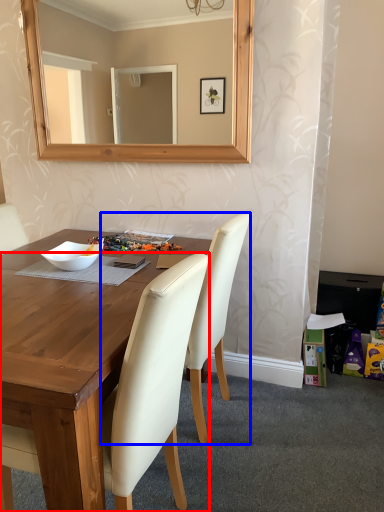
Question: Which point is closer to the camera, chair (highlighted by a red box) or chair (highlighted by a blue box)?

Choices:
 (A) chair
 (B) chair

Answer: (A)